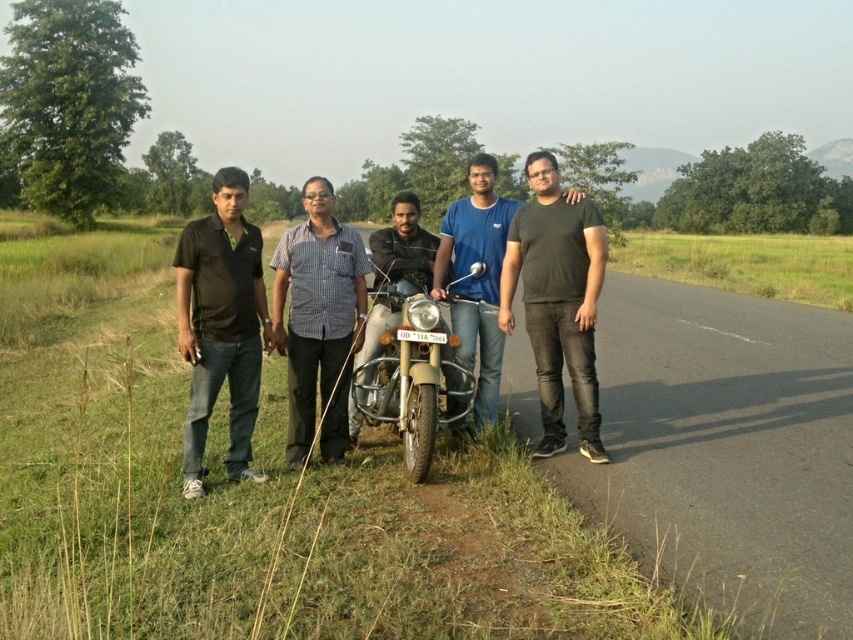
Who is taller, dark gray matte t-shirt at center or checkered fabric shirt at center?

dark gray matte t-shirt at center is taller.

Where is `dark gray matte t-shirt at center`? Image resolution: width=853 pixels, height=640 pixels. dark gray matte t-shirt at center is located at coordinates 556,301.

Where is `dark gray matte t-shirt at center`? This screenshot has height=640, width=853. dark gray matte t-shirt at center is located at coordinates (556, 301).

Can you confirm if checkered fabric shirt at center is shorter than matte beige motorcycle at center?

No.

Who is more distant from viewer, (347, 353) or (389, 417)?

Point (347, 353)

This screenshot has width=853, height=640. Identify the location of checkered fabric shirt at center. (318, 321).

Does black matte shirt at left appear on the right side of dark gray matte t-shirt at center?

In fact, black matte shirt at left is to the left of dark gray matte t-shirt at center.

Who is positioned more to the left, black matte shirt at left or dark gray matte t-shirt at center?

black matte shirt at left

You are a GUI agent. You are given a task and a screenshot of the screen. Output one action in this format:
    pyautogui.click(x=<x>, y=<y>)
    Task: Click on the black matte shirt at left
    
    Given the screenshot: What is the action you would take?
    pyautogui.click(x=221, y=324)